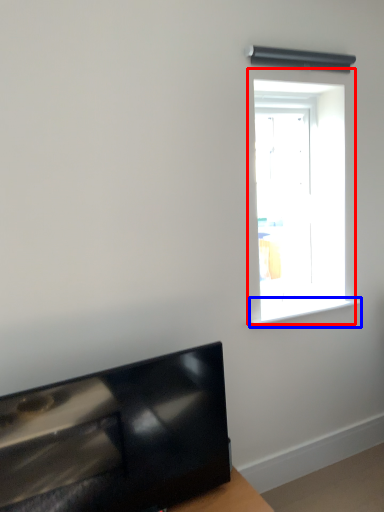
Question: Which of the following is the closest to the observer, window (highlighted by a red box) or window sill (highlighted by a blue box)?

Choices:
 (A) window
 (B) window sill

Answer: (A)